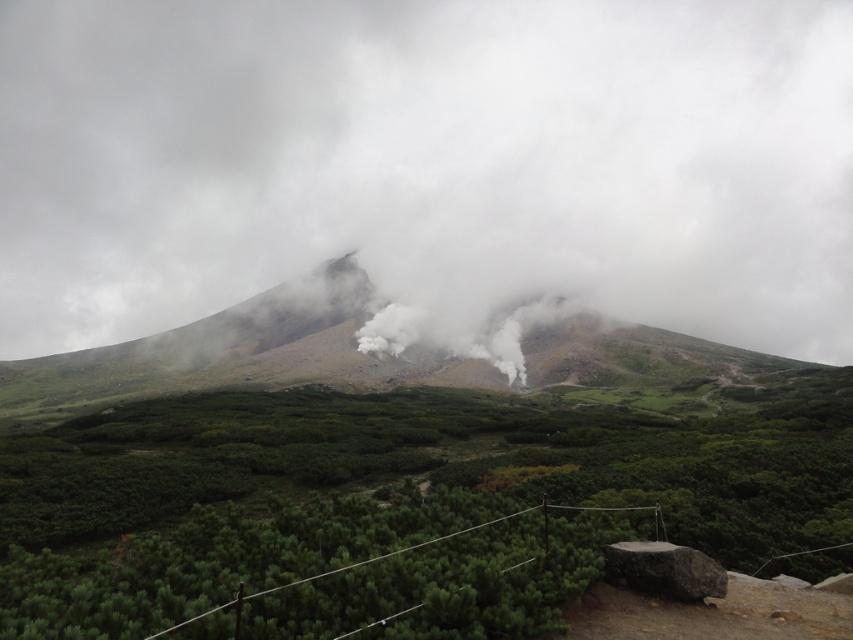
Can you confirm if white smoke at center is smaller than green leafy shrubs at center?

No.

Between white smoke at center and green leafy shrubs at center, which one is positioned lower?

Positioned lower is green leafy shrubs at center.

Image resolution: width=853 pixels, height=640 pixels. What are the coordinates of `white smoke at center` in the screenshot? It's located at pos(428,163).